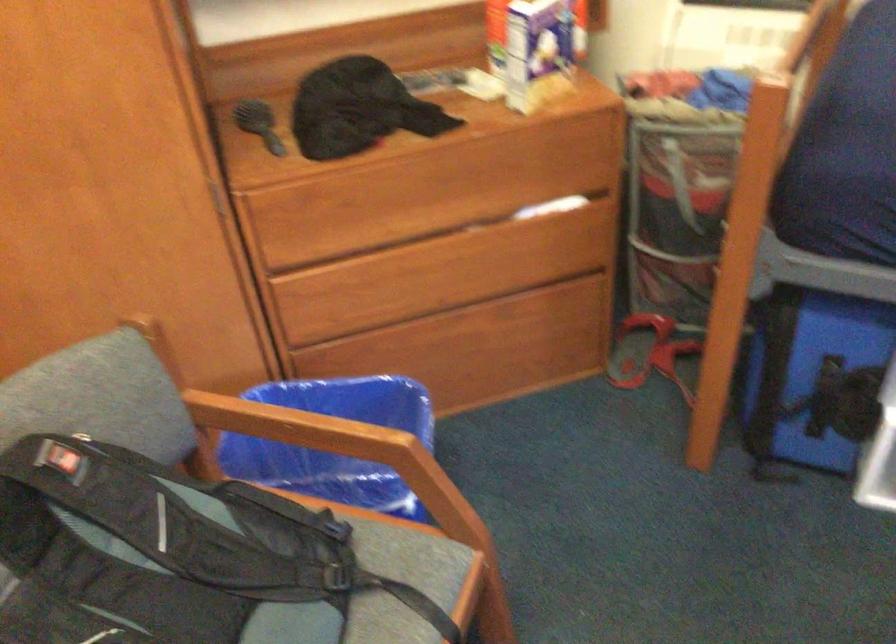
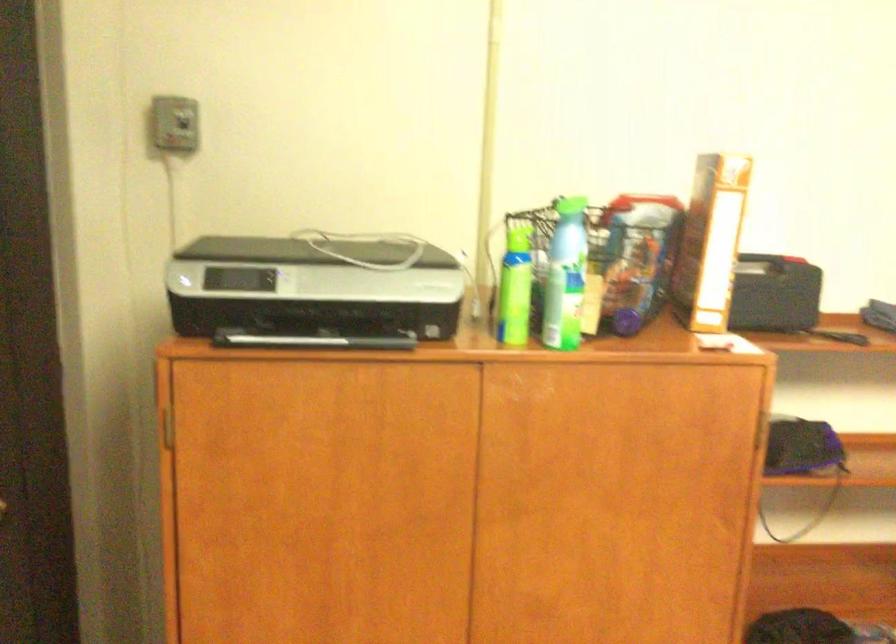
Question: The images are taken continuously from a first-person perspective. In which direction are you moving?

Choices:
 (A) Left
 (B) Right
 (C) Forward
 (D) Backward

Answer: (A)